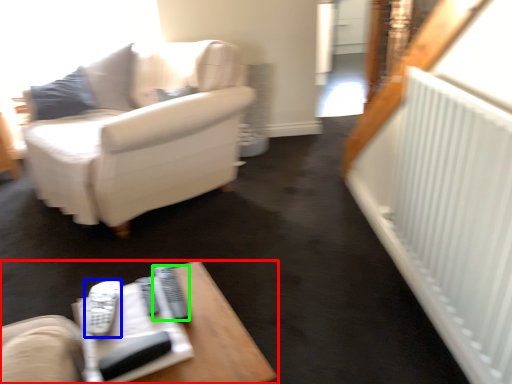
Question: Which is farther away from table (highlighted by a red box)? remote (highlighted by a blue box) or remote (highlighted by a green box)?

Choices:
 (A) remote
 (B) remote

Answer: (A)